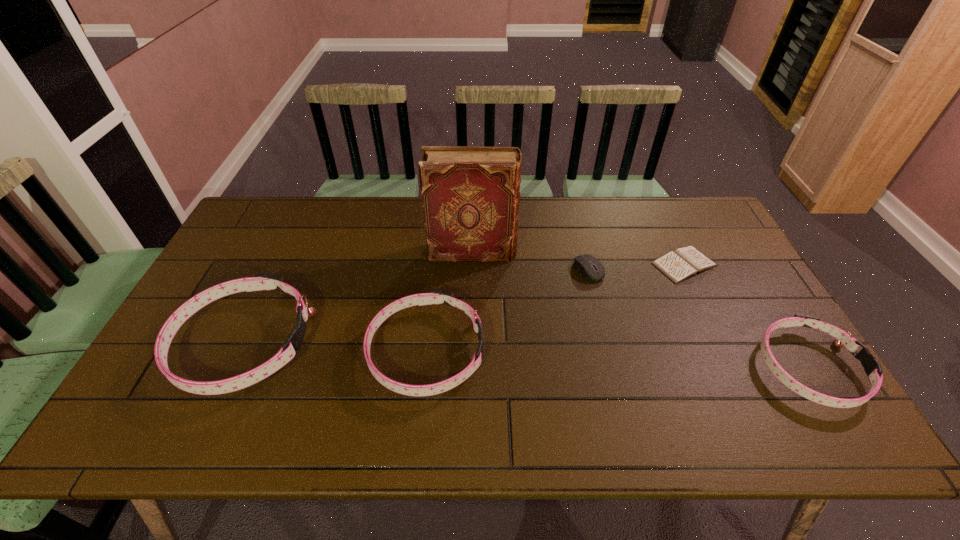
Identify the location of vacant space located 0.220m with the buckle on the second dog collar from left to right. (569, 352).

Locate an element on the screen. The width and height of the screenshot is (960, 540). vacant space situated 0.200m on the spine side of the hardback book is located at coordinates (580, 253).

Find the location of a particular element. The image size is (960, 540). free location located 0.330m on the front of the diary is located at coordinates (740, 382).

Locate an element on the screen. free space located 0.270m on the front of the computer equipment is located at coordinates (611, 360).

The image size is (960, 540). Find the location of `object that is at the left edge`. object that is at the left edge is located at coordinates (264, 281).

You are a GUI agent. You are given a task and a screenshot of the screen. Output one action in this format:
    pyautogui.click(x=<x>, y=<y>)
    Task: Click on the dog collar present at the right edge
    Image resolution: width=960 pixels, height=540 pixels.
    Given the screenshot: What is the action you would take?
    pyautogui.click(x=872, y=367)

Locate an element on the screen. diary that is at the right edge is located at coordinates (683, 263).

In order to click on object at the near left corner in this screenshot , I will do `click(264, 281)`.

The height and width of the screenshot is (540, 960). I want to click on object that is at the near right corner, so click(872, 367).

This screenshot has height=540, width=960. In the image, there is a desktop. What are the coordinates of `vacant area at the far edge` in the screenshot? It's located at (337, 203).